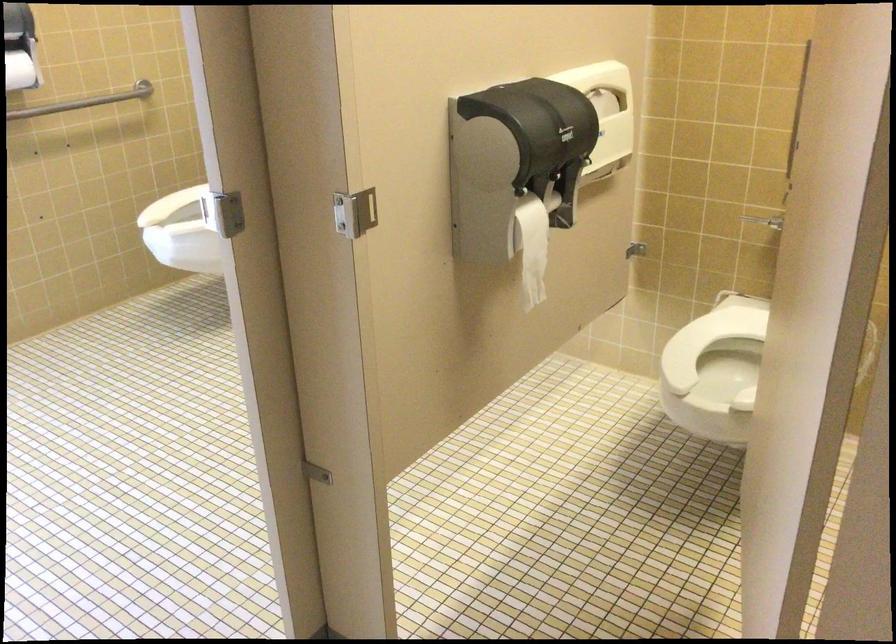
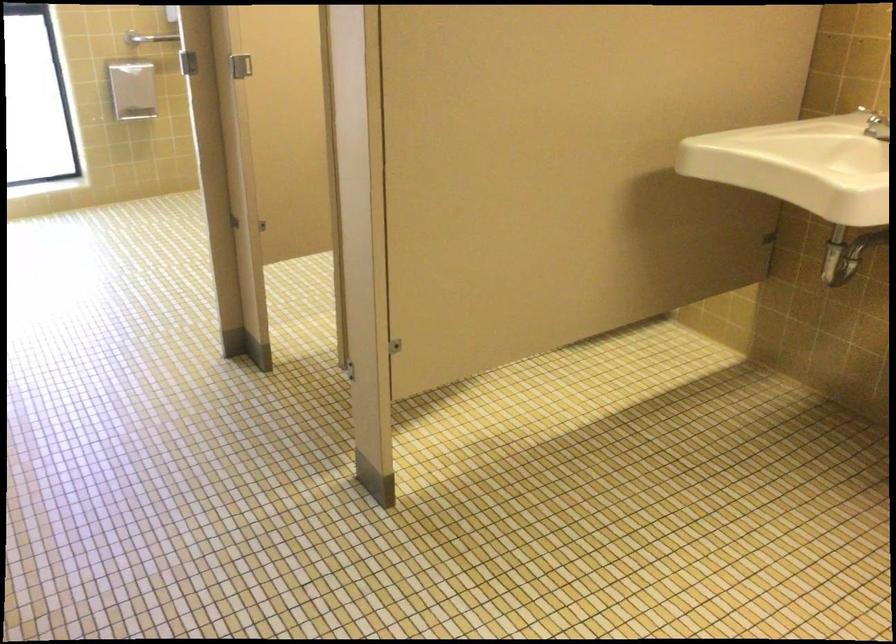
Question: I am providing you with two images of the same scene from different viewpoints. After the viewpoint changes to image2, which objects are now occluded?

Choices:
 (A) metal grab bar
 (B) metal stall latch
 (C) orange aluminum can
 (D) white toilet lid

Answer: (D)